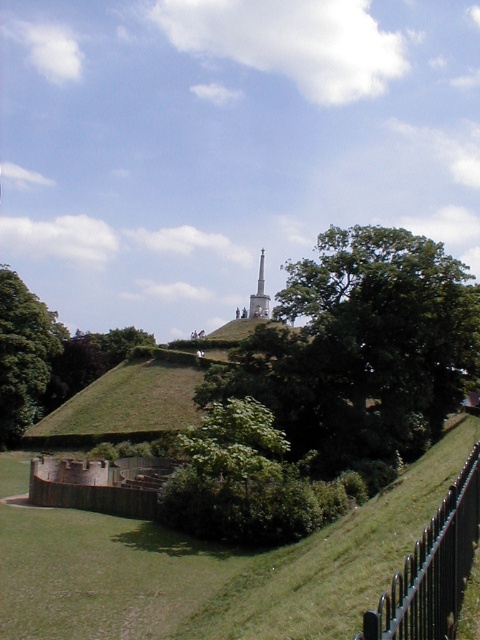
You are planning to take a photo of the white marble tower at center from the black metal fence at lower right. Considering their widths, which object would appear wider in the photo?

The black metal fence at lower right would appear wider in the photo since its actual width surpasses that of the white marble tower at center according to the description.

You are standing at the base of the hill looking towards the monument. You see the green leafy tree at upper center and the black metal fence at lower right. Which object is closer to you?

The green leafy tree at upper center is closer to you because the black metal fence at lower right is behind it.